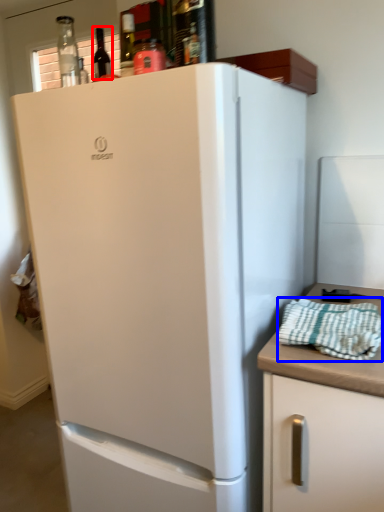
Question: Among these objects, which one is farthest to the camera, wine bottle (highlighted by a red box) or blanket (highlighted by a blue box)?

Choices:
 (A) wine bottle
 (B) blanket

Answer: (A)